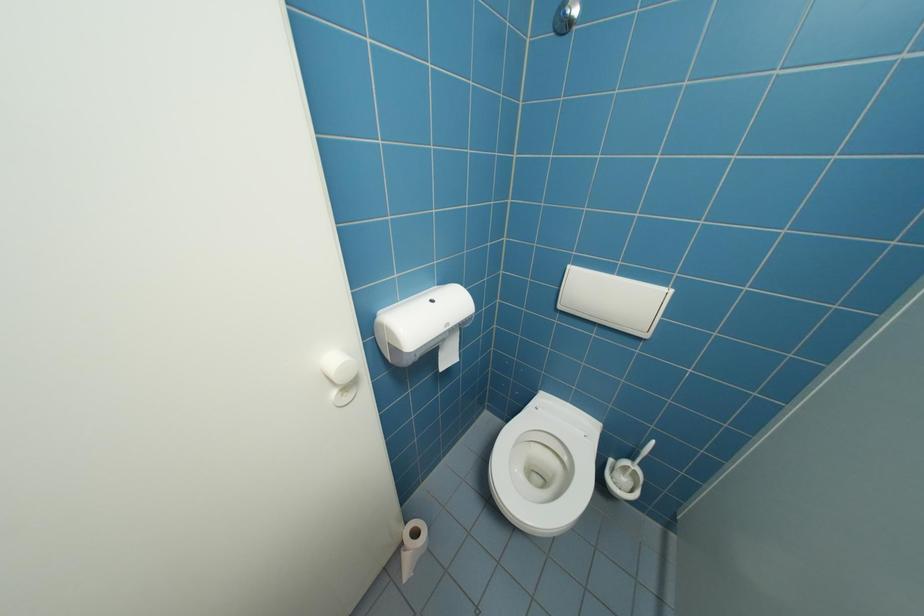
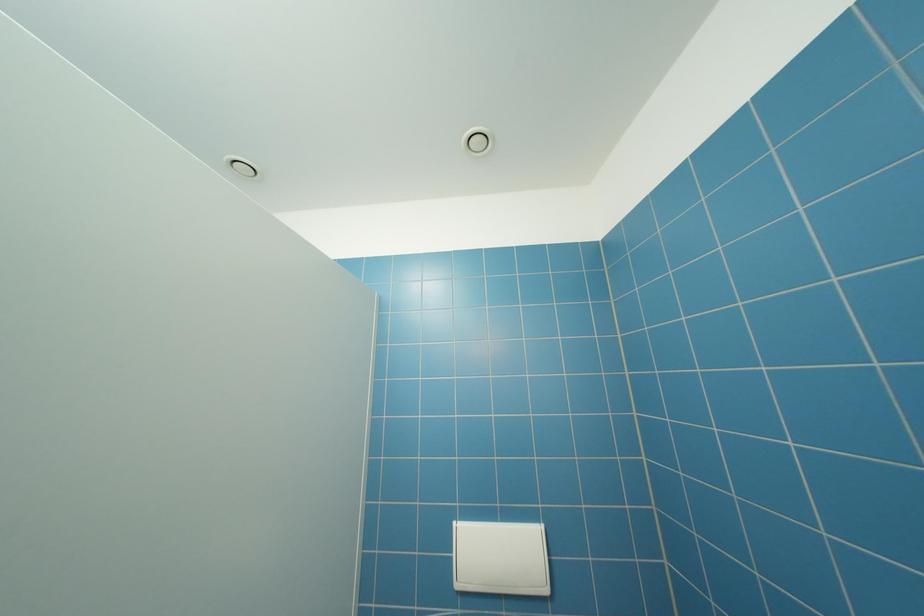
The first image is from the beginning of the video and the second image is from the end. How did the camera likely rotate when shooting the video?

The camera rotated toward right-up.